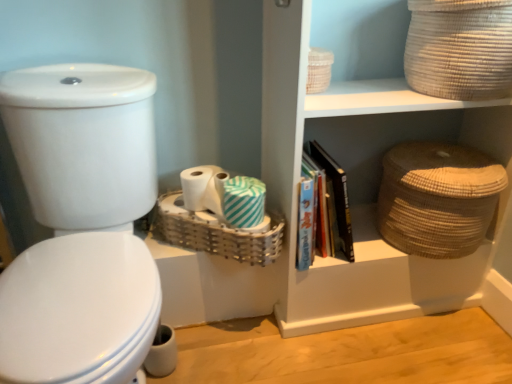
Question: From a real-world perspective, is natural woven basket at upper right located higher than white striped toilet paper at center, which appears as the first toilet paper when viewed from the left?

Choices:
 (A) no
 (B) yes

Answer: (B)

Question: Would you say white striped toilet paper at center, which is the second toilet paper in right-to-left order, is part of natural woven basket at upper right's contents?

Choices:
 (A) no
 (B) yes

Answer: (A)

Question: Can you confirm if natural woven basket at upper right is thinner than white striped toilet paper at center, which is the second toilet paper in right-to-left order?

Choices:
 (A) yes
 (B) no

Answer: (B)

Question: Are natural woven basket at upper right and white striped toilet paper at center, which is the second toilet paper in right-to-left order, far apart?

Choices:
 (A) yes
 (B) no

Answer: (B)

Question: Does natural woven basket at upper right have a greater height compared to white striped toilet paper at center, which appears as the first toilet paper when viewed from the left?

Choices:
 (A) no
 (B) yes

Answer: (B)

Question: From the image's perspective, relative to woven beige basket at upper right, which appears as the 2th basket when viewed from the right, is white striped toilet paper at center, which is the second toilet paper in right-to-left order, above or below?

Choices:
 (A) below
 (B) above

Answer: (A)

Question: In the image, is white striped toilet paper at center, which appears as the first toilet paper when viewed from the left, positioned in front of or behind woven beige basket at upper right, which appears as the 2th basket when viewed from the right?

Choices:
 (A) front
 (B) behind

Answer: (B)

Question: Considering the positions of white striped toilet paper at center, which appears as the first toilet paper when viewed from the left, and woven beige basket at upper right, which appears as the 2th basket when viewed from the right, in the image, is white striped toilet paper at center, which appears as the first toilet paper when viewed from the left, taller or shorter than woven beige basket at upper right, which appears as the 2th basket when viewed from the right,?

Choices:
 (A) tall
 (B) short

Answer: (B)

Question: Would you say white striped toilet paper at center, which appears as the first toilet paper when viewed from the left, is to the left or to the right of woven beige basket at upper right, the 2th basket when ordered from left to right, in the picture?

Choices:
 (A) left
 (B) right

Answer: (A)

Question: In terms of width, does hardcover book at center look wider or thinner when compared to white glossy toilet at left?

Choices:
 (A) thin
 (B) wide

Answer: (A)

Question: Relative to white glossy toilet at left, is hardcover book at center in front or behind?

Choices:
 (A) front
 (B) behind

Answer: (B)

Question: From the image's perspective, is hardcover book at center located above or below white glossy toilet at left?

Choices:
 (A) above
 (B) below

Answer: (A)

Question: From a real-world perspective, relative to white glossy toilet at left, is hardcover book at center vertically above or below?

Choices:
 (A) above
 (B) below

Answer: (B)

Question: Based on their sizes in the image, would you say white glossy toilet at left is bigger or smaller than brown woven basket at right, positioned as the third basket in left-to-right order?

Choices:
 (A) big
 (B) small

Answer: (A)

Question: From a real-world perspective, is white glossy toilet at left physically located above or below brown woven basket at right, which is counted as the 1th basket, starting from the right?

Choices:
 (A) above
 (B) below

Answer: (A)